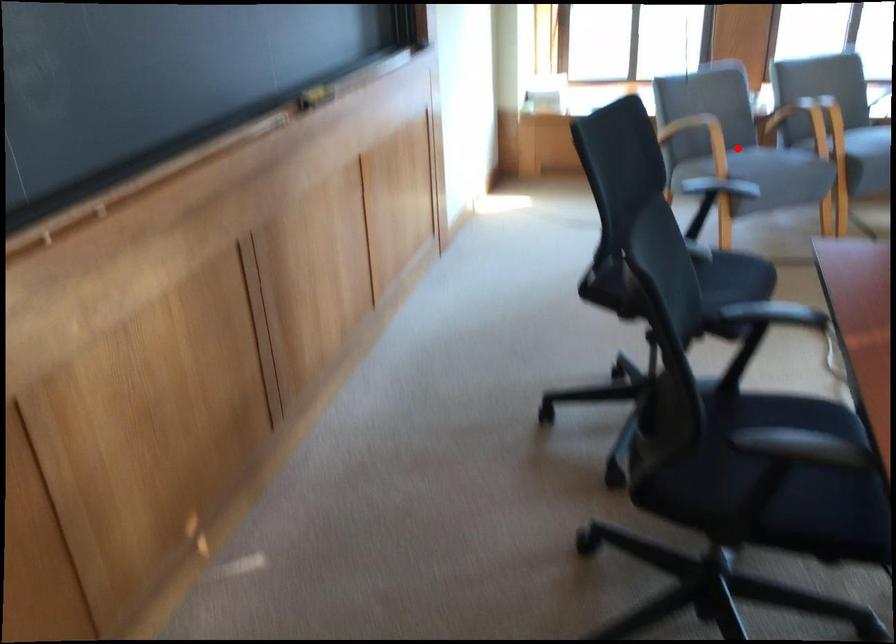
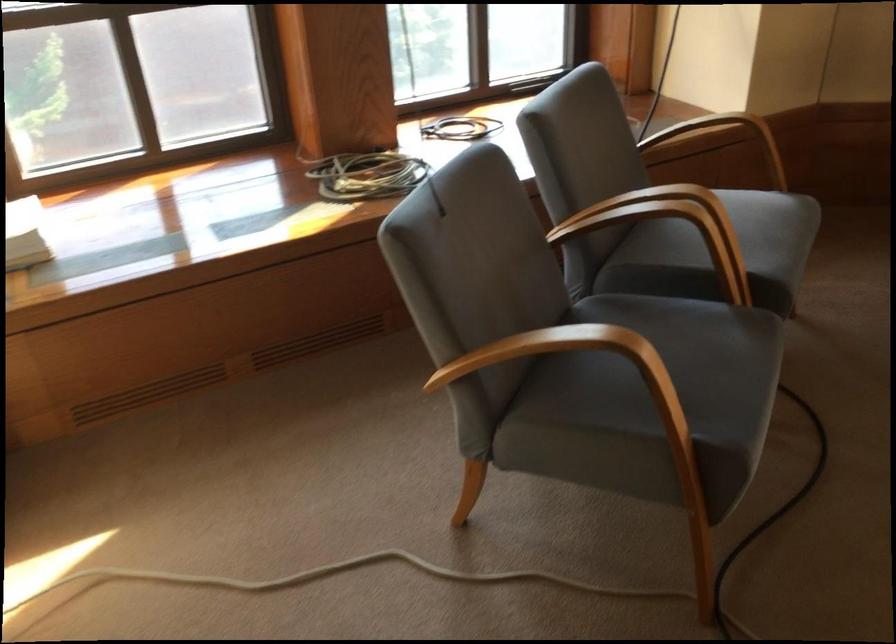
Question: I am providing you with two images of the same scene from different viewpoints. Given a red point in image1, look at the same physical point in image2. Is it:

Choices:
 (A) Closer to the viewpoint
 (B) Farther from the viewpoint

Answer: (A)